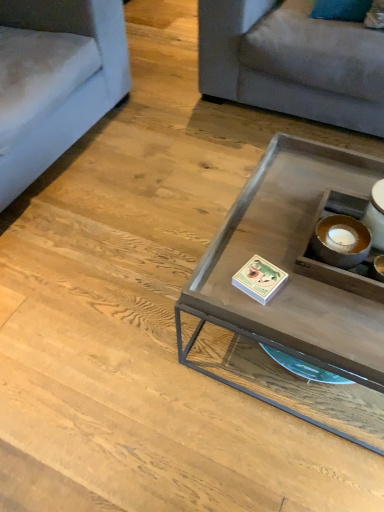
Where is `blank area to the left of matte glass coffee table at center`? The height and width of the screenshot is (512, 384). blank area to the left of matte glass coffee table at center is located at coordinates (112, 313).